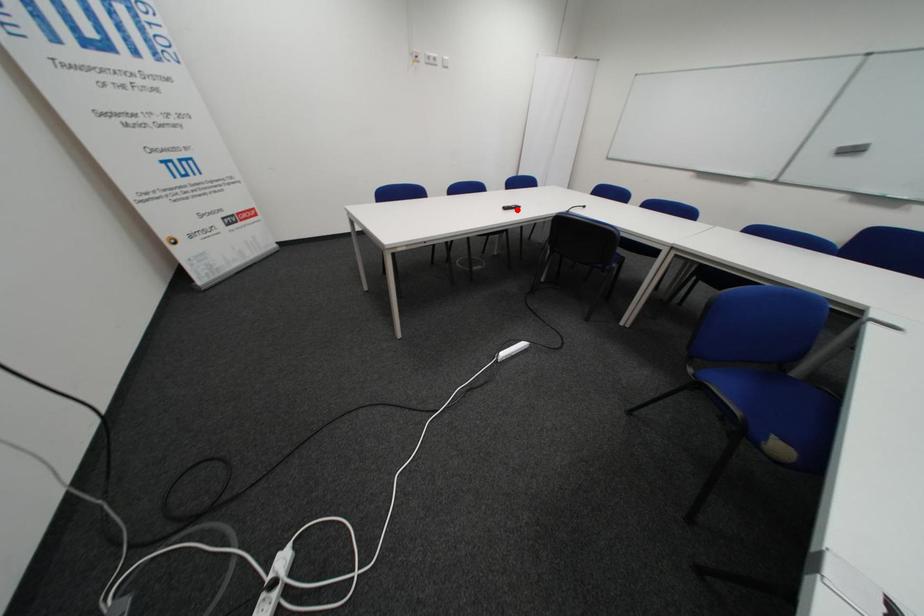
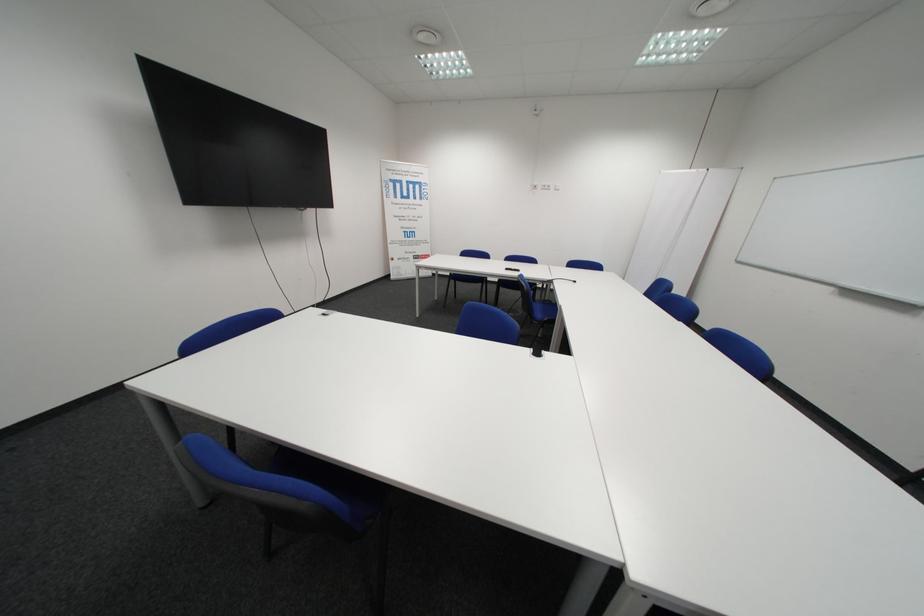
Find the pixel in the second image that matches the highlighted location in the first image.

(518, 270)